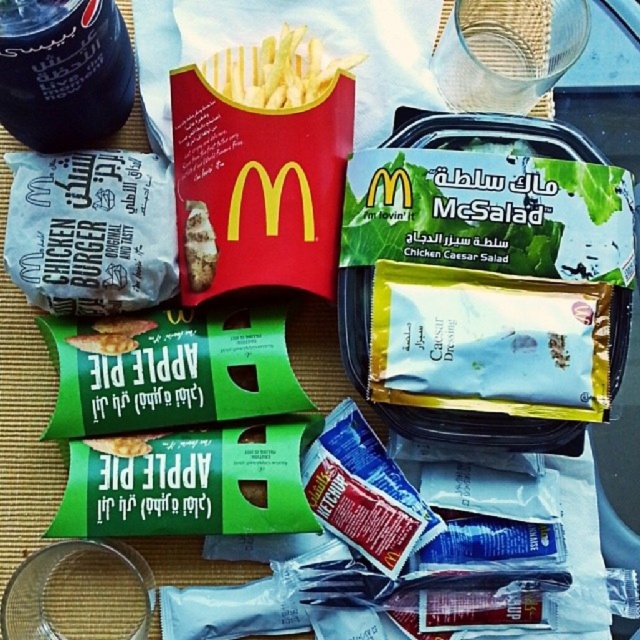
Question: Can you confirm if dark matte soda can at upper left is wider than golden crispy fries at center?

Choices:
 (A) no
 (B) yes

Answer: (A)

Question: Which point is closer to the camera?

Choices:
 (A) golden crispy fries at center
 (B) dark matte soda can at upper left
 (C) white paper chicken burger at left

Answer: (B)

Question: Which object appears farthest from the camera in this image?

Choices:
 (A) dark matte soda can at upper left
 (B) white paper chicken burger at left
 (C) golden crispy fries at center

Answer: (C)

Question: Which point appears closest to the camera in this image?

Choices:
 (A) (20, 16)
 (B) (20, 250)

Answer: (A)

Question: Is white paper chicken burger at left to the left of golden crispy fries at center from the viewer's perspective?

Choices:
 (A) yes
 (B) no

Answer: (A)

Question: Does white paper chicken burger at left appear over golden crispy fries at center?

Choices:
 (A) no
 (B) yes

Answer: (A)